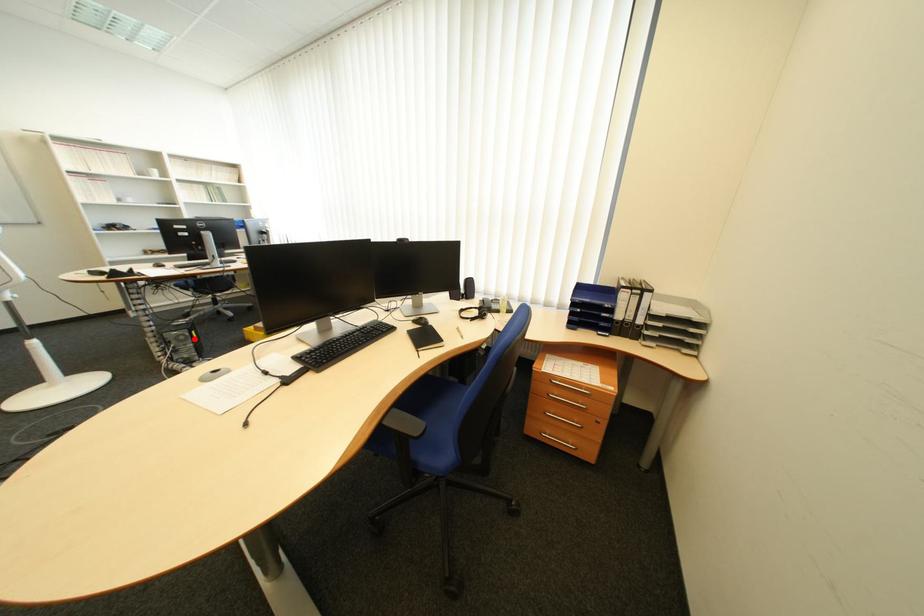
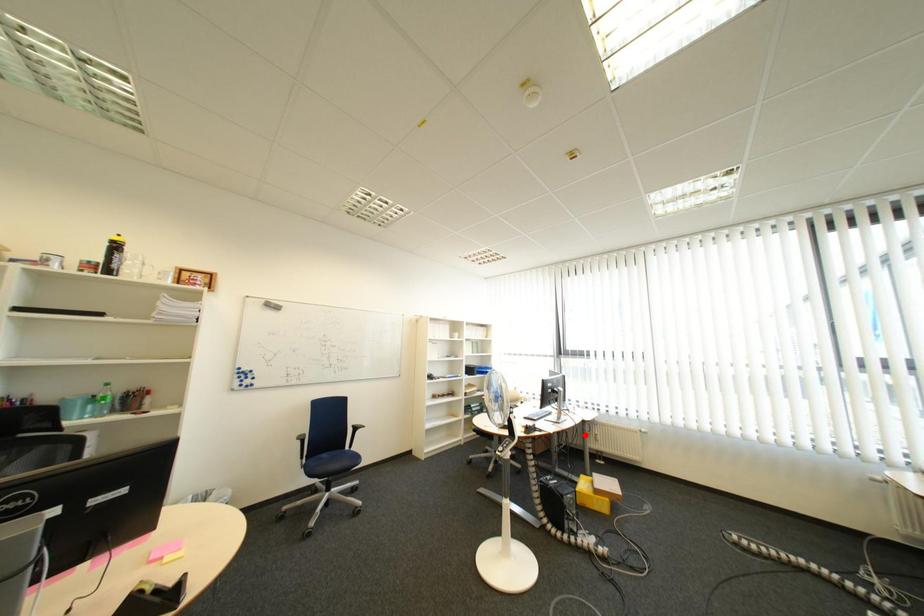
I am providing you with two images of the same scene from different viewpoints. A red point is marked on the first image and another point is marked on the second image. Do the highlighted points in image1 and image2 indicate the same real-world spot?

No